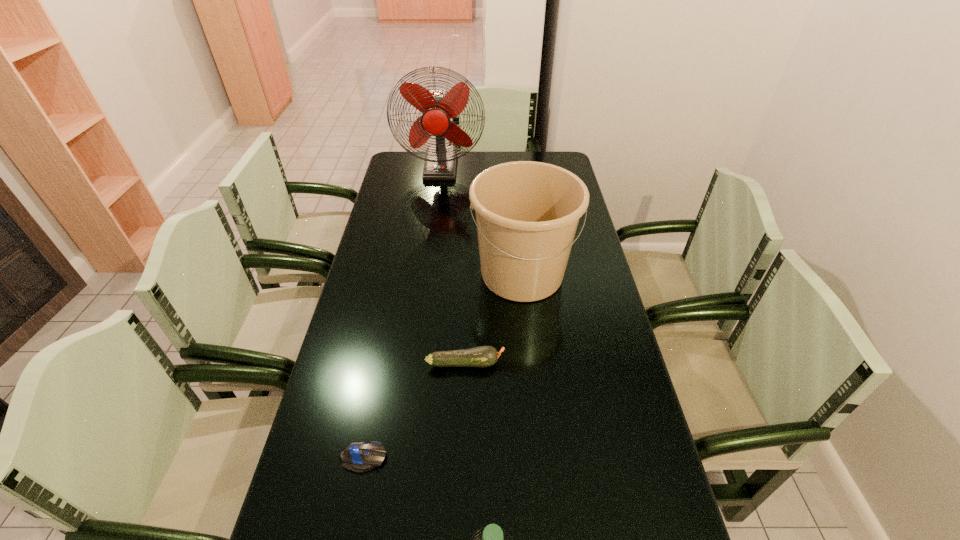
Where is `vacant space situated at the blossom end of the second shortest object`? vacant space situated at the blossom end of the second shortest object is located at coordinates (605, 363).

Locate an element on the screen. vacant position located 0.190m on the button side of the computer mouse is located at coordinates (470, 458).

Image resolution: width=960 pixels, height=540 pixels. Identify the location of object located at the far edge. (437, 106).

Where is `fan positioned at the left edge`? The width and height of the screenshot is (960, 540). fan positioned at the left edge is located at coordinates (437, 106).

What are the coordinates of `computer mouse at the left edge` in the screenshot? It's located at pos(359,457).

In order to click on object that is at the right edge in this screenshot , I will do `click(527, 213)`.

At what (x,y) coordinates should I click in order to perform the action: click on object positioned at the far left corner. Please return your answer as a coordinate pair (x, y). Looking at the image, I should click on (437, 106).

The height and width of the screenshot is (540, 960). Identify the location of vacant region at the far edge of the desktop. (519, 159).

What are the coordinates of `vacant region at the left edge of the desktop` in the screenshot? It's located at pyautogui.click(x=382, y=321).

This screenshot has width=960, height=540. In the image, there is a desktop. In order to click on vacant space at the right edge in this screenshot , I will do `click(587, 380)`.